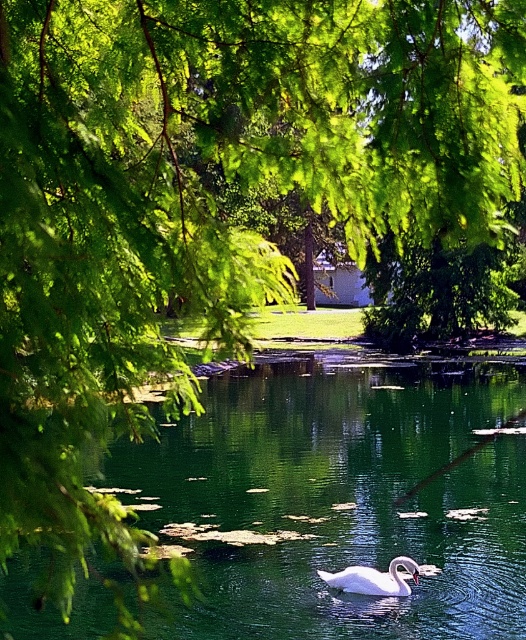
You are a photographer trying to capture a clear shot of the white glossy swan at center. However, the green glossy lake at center is blocking part of the view. Can you adjust your position to ensure the swan is fully visible without any obstruction from the lake?

The green glossy lake at center is taller than the white glossy swan at center, so adjusting your position to a higher angle or moving closer might help reduce the lake obstructing the swan.

In the scene shown: You are a photographer planning to capture the green glossy lake at center and the white glossy swan at center in a single frame. Considering their widths, which object should you position closer to the center of your camera frame to ensure both are fully visible?

The green glossy lake at center is wider than the white glossy swan at center. To ensure both are fully visible in the frame, position the green glossy lake at center closer to the center of your camera frame since it requires more space.

You are standing at the edge of the green glossy lake at center and want to see the white glossy swan at center. In which direction should you look relative to your position?

The green glossy lake at center is located above the white glossy swan at center, so you should look downward to see the white glossy swan at center.